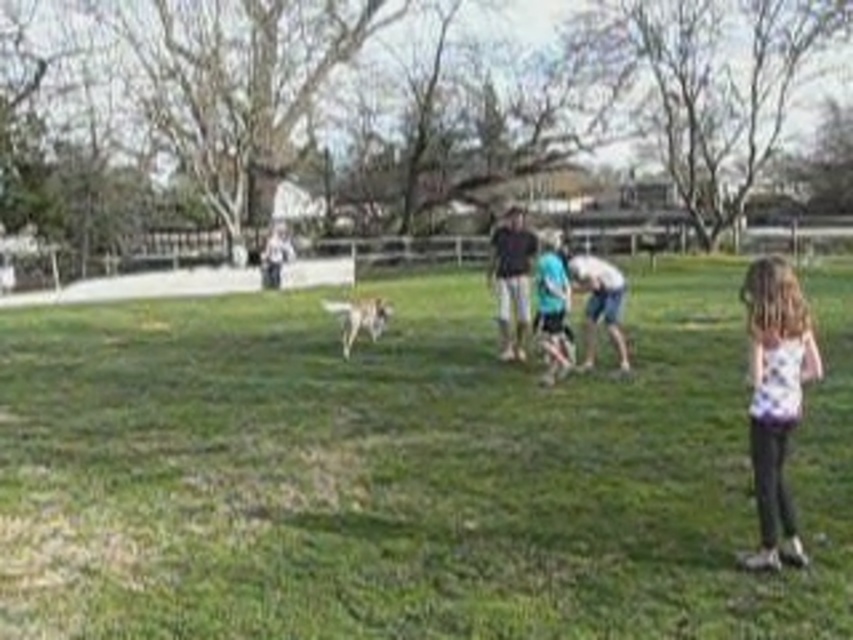
You are standing at the point labeled point (332, 308) and want to walk to the point labeled point (733, 593). Which direction should you head?

You should head forward because point (733, 593) is in front of point (332, 308).

You are standing in the park and see a dog running towards the left side of the frame. There is a point marked at coordinates (x=776, y=397) which indicates a white printed shirt at right. Based on the scene description, can you determine the direction the person wearing the white printed shirt is facing?

The point at coordinates (x=776, y=397) indicates the white printed shirt at right. Since the dog is running towards the left side of the frame, the person wearing the white printed shirt is likely facing towards the right side of the frame.

You are standing in the park and see the white printed shirt at right. Where exactly is it located in the image?

The white printed shirt at right is located at point 0.622 on the x axis and 0.911 on the y axis.